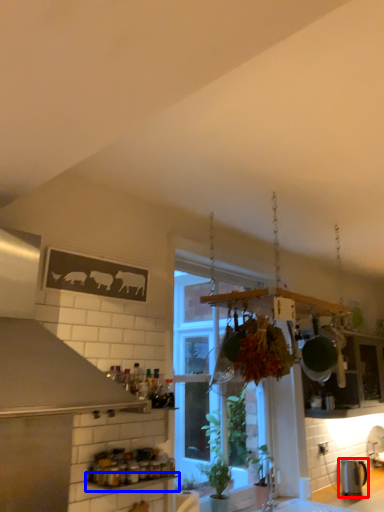
Question: Which object is further to the camera taking this photo, kitchen appliance (highlighted by a red box) or window sill (highlighted by a blue box)?

Choices:
 (A) kitchen appliance
 (B) window sill

Answer: (A)